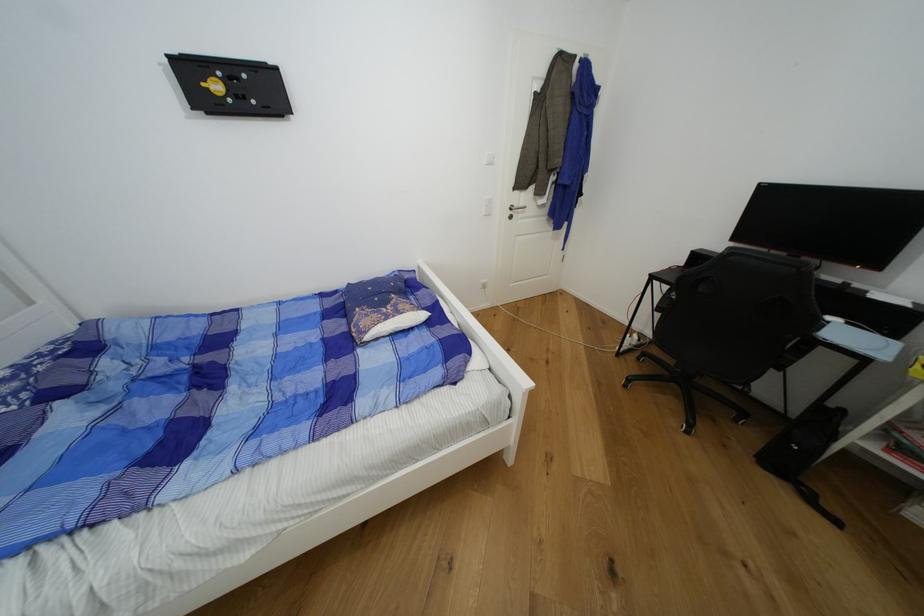
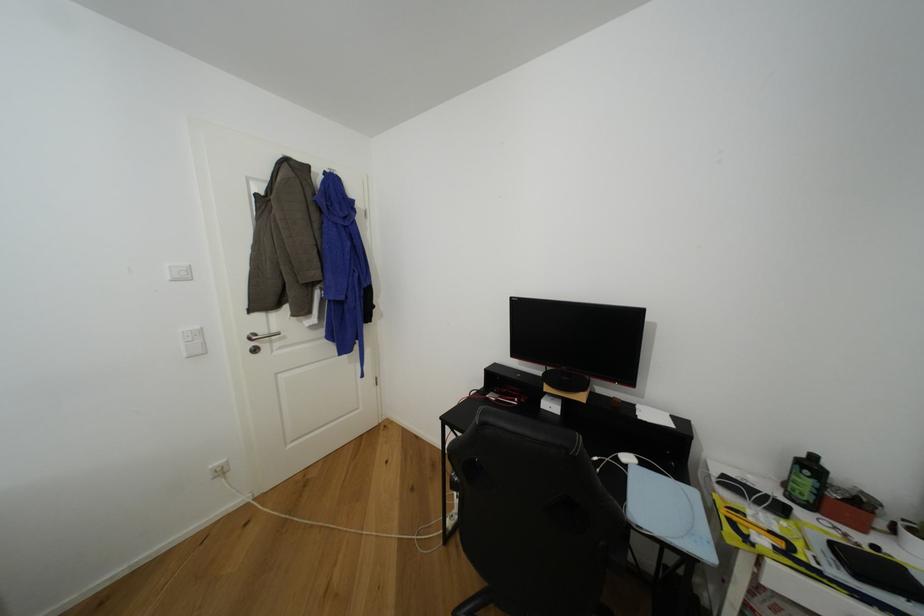
In the second image, find the point that corresponds to (521,207) in the first image.

(268, 334)